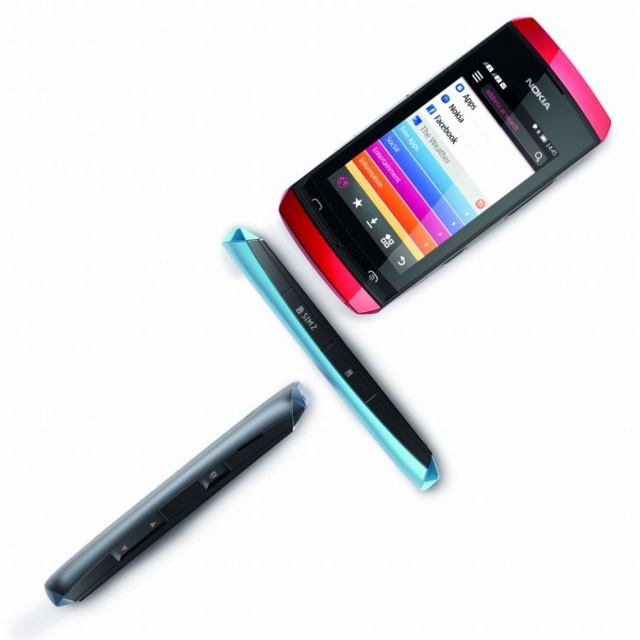
Question: Which point is closer to the camera?

Choices:
 (A) 433,92
 (B) 385,420
 (C) 157,500

Answer: (C)

Question: Is pink glossy smartphone at upper center positioned before translucent plastic stylus at center?

Choices:
 (A) yes
 (B) no

Answer: (A)

Question: Is black glossy pen at center below translucent plastic stylus at center?

Choices:
 (A) no
 (B) yes

Answer: (B)

Question: Which object is the farthest from the translucent plastic stylus at center?

Choices:
 (A) pink glossy smartphone at upper center
 (B) black glossy pen at center

Answer: (A)

Question: Is black glossy pen at center wider than translucent plastic stylus at center?

Choices:
 (A) no
 (B) yes

Answer: (B)

Question: Which point is farther from the camera taking this photo?

Choices:
 (A) (525, 24)
 (B) (253, 262)
 (C) (209, 448)

Answer: (B)